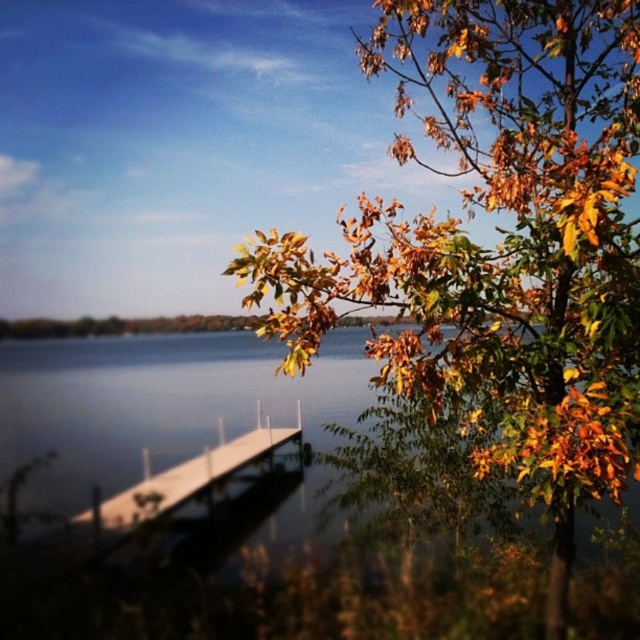
You are an artist planning to paint this lakeside scene. You want to ensure the golden leafy tree at upper right and the white wood dock at lower center are proportionally accurate. Which object should you draw wider in your painting?

The golden leafy tree at upper right should be drawn wider in the painting since its width surpasses that of the white wood dock at lower center according to the description.

You are standing at the lakeside and see two points marked in the image. The first point is at coordinates point (x=536, y=454) and the second point is at point (x=272, y=428). Which of these two points is closer to you?

Point (x=536, y=454) is closer to the viewer than point (x=272, y=428).